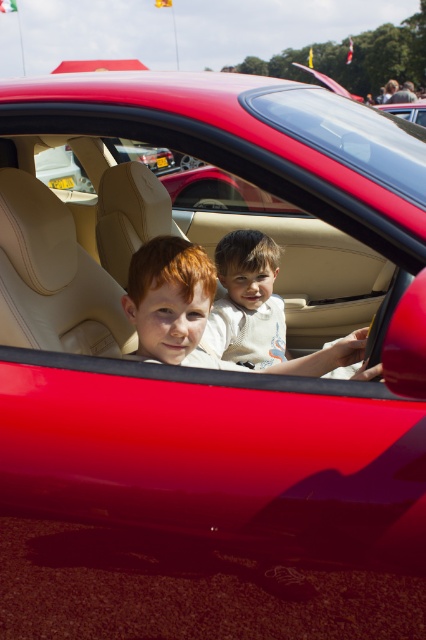
Who is positioned more to the right, light beige leather child at center or glossy red car at upper center?

glossy red car at upper center

The height and width of the screenshot is (640, 426). What do you see at coordinates (262, 312) in the screenshot? I see `light beige leather child at center` at bounding box center [262, 312].

Is point (296, 362) positioned behind point (376, 106)?

No.

The height and width of the screenshot is (640, 426). In order to click on light beige leather child at center in this screenshot , I will do `click(262, 312)`.